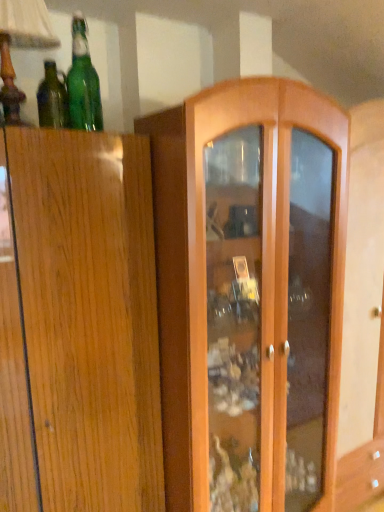
Question: Is green glass bottle at upper left, placed as the 2th bottle when sorted from right to left, not within wooden table lamp at upper left?

Choices:
 (A) no
 (B) yes

Answer: (A)

Question: From a real-world perspective, is green glass bottle at upper left, placed as the 2th bottle when sorted from right to left, beneath wooden table lamp at upper left?

Choices:
 (A) no
 (B) yes

Answer: (B)

Question: Is green glass bottle at upper left, placed as the 2th bottle when sorted from right to left, further to the viewer compared to wooden table lamp at upper left?

Choices:
 (A) yes
 (B) no

Answer: (A)

Question: Would you say wooden table lamp at upper left is part of green glass bottle at upper left, the 1th bottle positioned from the left,'s contents?

Choices:
 (A) no
 (B) yes

Answer: (A)

Question: Is green glass bottle at upper left, placed as the 2th bottle when sorted from right to left, shorter than wooden table lamp at upper left?

Choices:
 (A) no
 (B) yes

Answer: (B)

Question: In terms of height, does wooden table lamp at upper left look taller or shorter compared to green glass bottle at upper left, placed as the first bottle when sorted from right to left?

Choices:
 (A) tall
 (B) short

Answer: (A)

Question: Is wooden table lamp at upper left wider or thinner than green glass bottle at upper left, which appears as the 2th bottle when viewed from the left?

Choices:
 (A) wide
 (B) thin

Answer: (A)

Question: From the image's perspective, is wooden table lamp at upper left above or below green glass bottle at upper left, which appears as the 2th bottle when viewed from the left?

Choices:
 (A) below
 (B) above

Answer: (B)

Question: Is wooden table lamp at upper left spatially inside green glass bottle at upper left, which appears as the 2th bottle when viewed from the left, or outside of it?

Choices:
 (A) outside
 (B) inside

Answer: (A)

Question: Considering the positions of point (49, 65) and point (94, 75), is point (49, 65) closer or farther from the camera than point (94, 75)?

Choices:
 (A) closer
 (B) farther

Answer: (B)

Question: Is green glass bottle at upper left, placed as the 2th bottle when sorted from right to left, wider or thinner than green glass bottle at upper left, placed as the first bottle when sorted from right to left?

Choices:
 (A) thin
 (B) wide

Answer: (A)

Question: From the image's perspective, is green glass bottle at upper left, the 1th bottle positioned from the left, positioned above or below green glass bottle at upper left, which appears as the 2th bottle when viewed from the left?

Choices:
 (A) above
 (B) below

Answer: (B)

Question: In the image, is green glass bottle at upper left, placed as the 2th bottle when sorted from right to left, positioned in front of or behind green glass bottle at upper left, which appears as the 2th bottle when viewed from the left?

Choices:
 (A) behind
 (B) front

Answer: (A)

Question: Visually, is green glass bottle at upper left, placed as the first bottle when sorted from right to left, positioned to the left or to the right of green glass bottle at upper left, the 1th bottle positioned from the left?

Choices:
 (A) left
 (B) right

Answer: (B)

Question: Considering the positions of point (97, 84) and point (51, 111), is point (97, 84) closer or farther from the camera than point (51, 111)?

Choices:
 (A) closer
 (B) farther

Answer: (A)